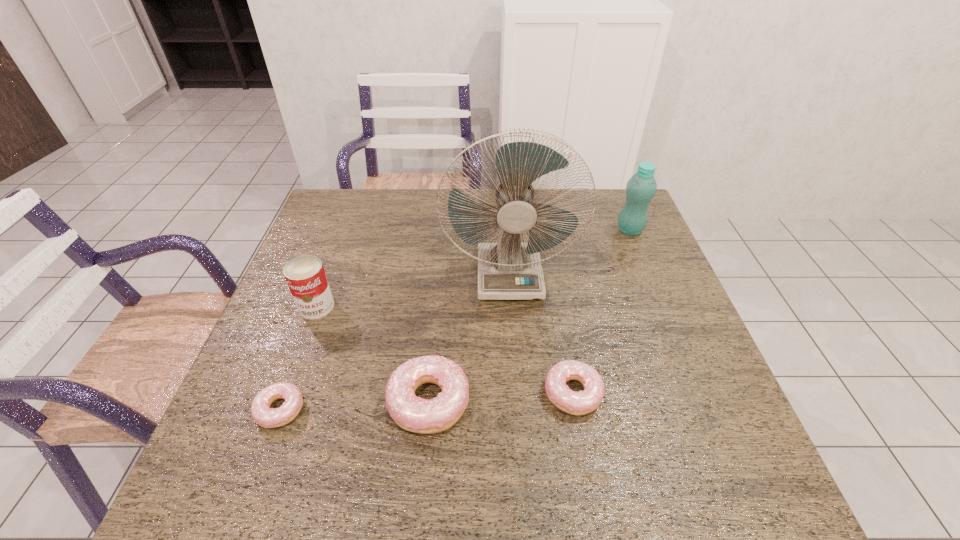
Find the location of a particular element. The width and height of the screenshot is (960, 540). can that is at the left edge is located at coordinates (305, 276).

Find the location of a particular element. This screenshot has width=960, height=540. object positioned at the right edge is located at coordinates (641, 188).

The height and width of the screenshot is (540, 960). Identify the location of object that is at the near left corner. (266, 417).

Locate an element on the screen. This screenshot has width=960, height=540. object located at the far right corner is located at coordinates (641, 188).

At what (x,y) coordinates should I click in order to perform the action: click on vacant area at the far edge. Please return your answer as a coordinate pair (x, y). Looking at the image, I should click on (588, 210).

Identify the location of vacant space at the near edge of the desktop. The image size is (960, 540). (492, 404).

Locate an element on the screen. The width and height of the screenshot is (960, 540). free space at the left edge is located at coordinates (278, 401).

Locate an element on the screen. vacant region at the right edge of the desktop is located at coordinates (644, 242).

In the image, there is a desktop. At what (x,y) coordinates should I click in order to perform the action: click on vacant region at the far left corner. Please return your answer as a coordinate pair (x, y). Image resolution: width=960 pixels, height=540 pixels. Looking at the image, I should click on (330, 205).

Find the location of a particular element. blank region between the farthest object and the leftmost doughnut is located at coordinates (455, 320).